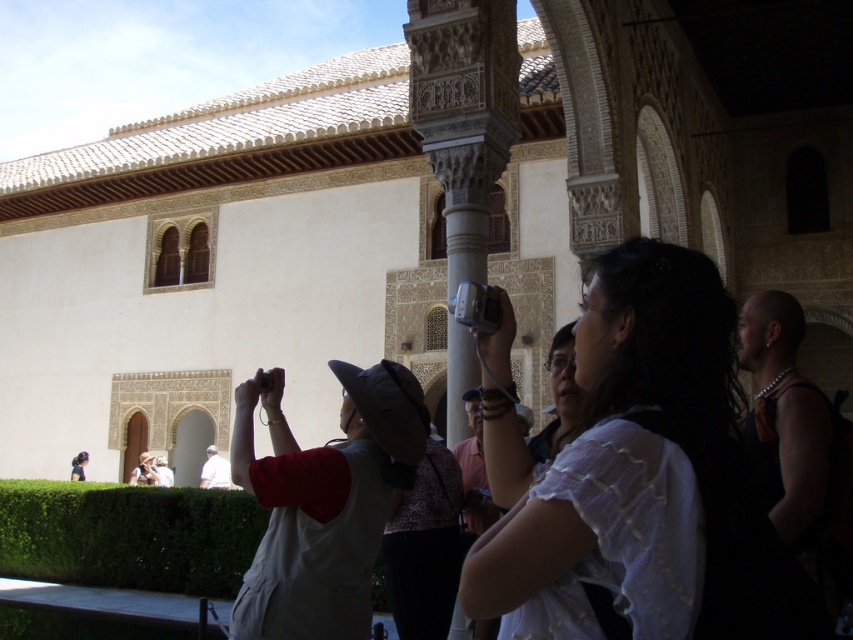
You are a photographer standing at the entrance of the historical site. You want to take a photo that includes both the gray fabric hat at center and the matte white shirt at center. What is the minimum distance you need to move backward to ensure both subjects are in frame?

The gray fabric hat at center and the matte white shirt at center are 54.24 meters apart. To include both in your photo, you need to move backward until the distance between them fits within your camera frame. The exact distance depends on your camera lens, but generally, increasing distance reduces the apparent separation between subjects in the frame.

You are a photographer trying to capture the intricate details of the historical site. You notice two shirts in the foreground that might obstruct your shot. The white lace shirt at center and the matte white shirt at center. Which shirt should you focus on to ensure the details of the building are visible?

The white lace shirt at center is above the matte white shirt at center, so focusing on the white lace shirt at center would allow you to capture the details of the building as it is positioned higher and might block more of the view.